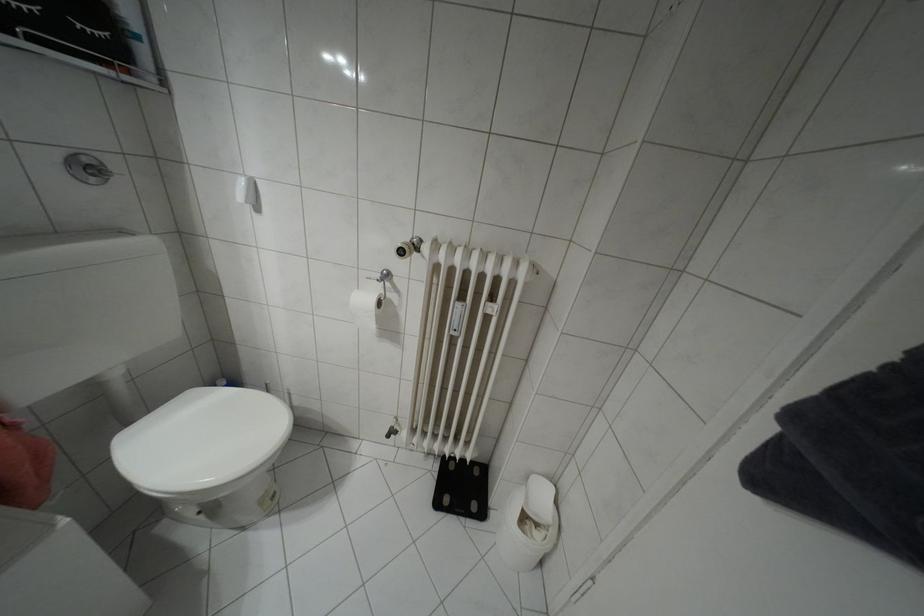
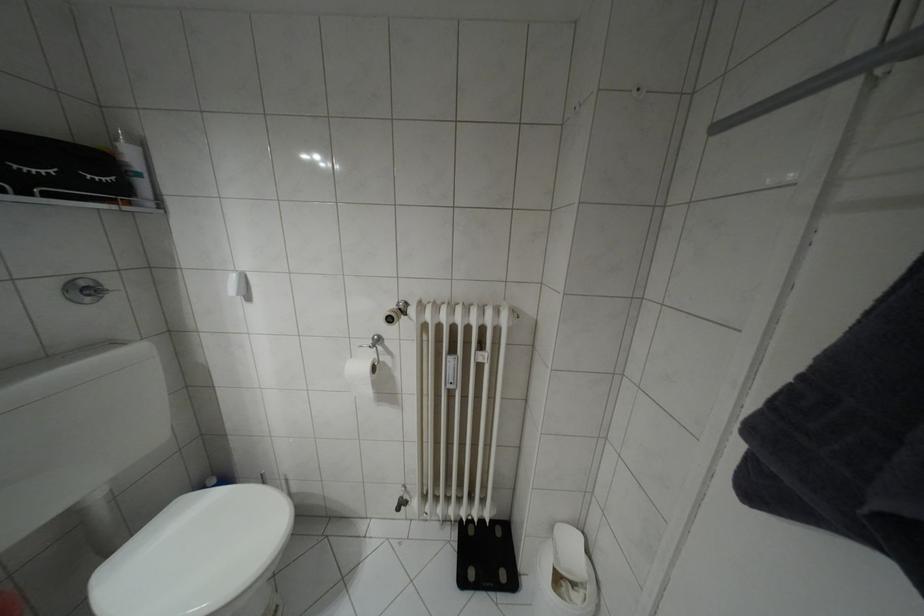
The point at [33,39] is marked in the first image. Where is the corresponding point in the second image?

(49, 195)